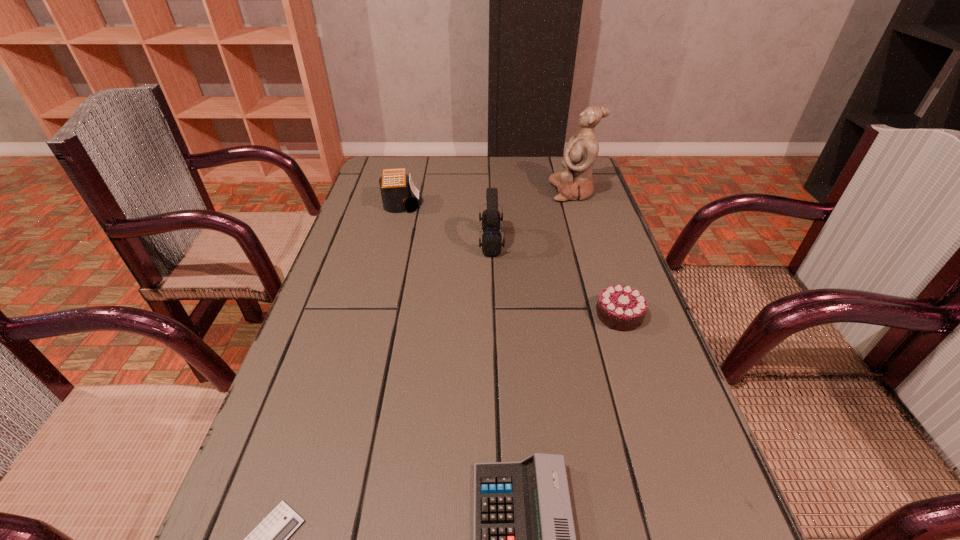
At what (x,y) coordinates should I click in order to perform the action: click on free region located on the headband of the fourth nearest object. Please return your answer as a coordinate pair (x, y). Looking at the image, I should click on (353, 242).

Where is `vacant region located 0.170m on the headband of the fourth nearest object`? vacant region located 0.170m on the headband of the fourth nearest object is located at coordinates (414, 242).

Identify the location of vacant point located 0.240m on the headband of the fourth nearest object. (387, 242).

This screenshot has width=960, height=540. What are the coordinates of `vacant space located 0.270m on the right of the tallest calculator` in the screenshot? It's located at (514, 205).

You are a GUI agent. You are given a task and a screenshot of the screen. Output one action in this format:
    pyautogui.click(x=<x>, y=<y>)
    Task: Click on the vacant point located on the left of the fourth farthest object
    The height and width of the screenshot is (540, 960).
    Given the screenshot: What is the action you would take?
    pyautogui.click(x=439, y=315)

At what (x,y) coordinates should I click in order to perform the action: click on object situated at the far edge. Please return your answer as a coordinate pair (x, y). Looking at the image, I should click on (575, 182).

The image size is (960, 540). What are the coordinates of `object located in the left edge section of the desktop` in the screenshot? It's located at point(395,185).

Where is `figurine that is positioned at the right edge`? figurine that is positioned at the right edge is located at coordinates (575, 182).

This screenshot has height=540, width=960. What are the coordinates of `chocolate cake present at the right edge` in the screenshot? It's located at (622, 308).

Locate an element on the screen. object positioned at the far right corner is located at coordinates (575, 182).